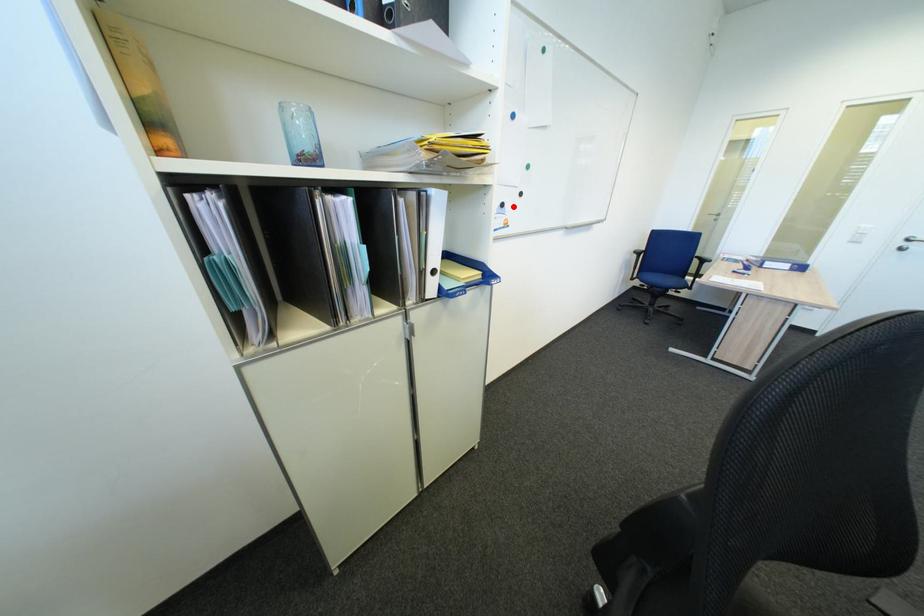
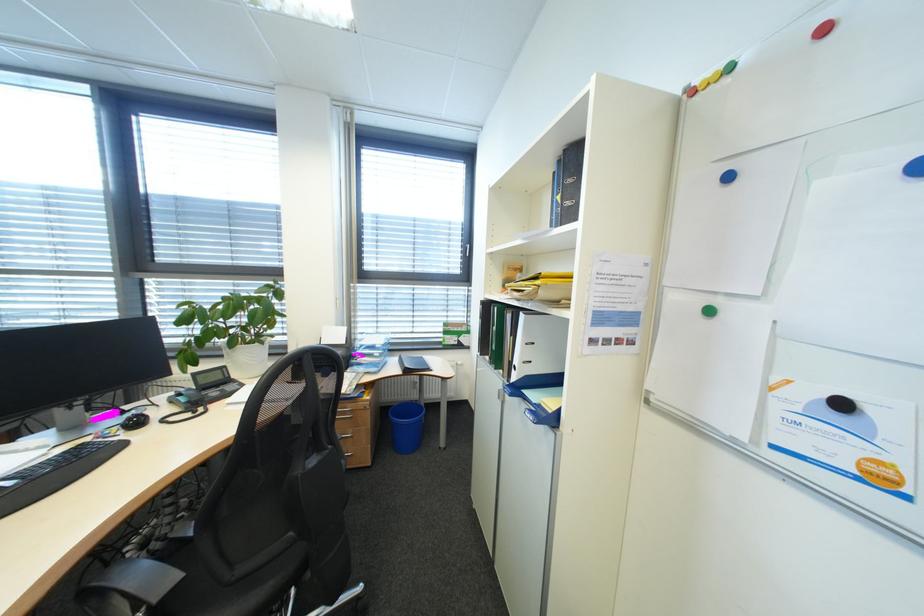
Question: I am providing you with two images of the same scene from different viewpoints. A red point is shown in image1. For the corresponding object point in image2, is it positioned nearer or farther from the camera?

Choices:
 (A) Nearer
 (B) Farther

Answer: (B)